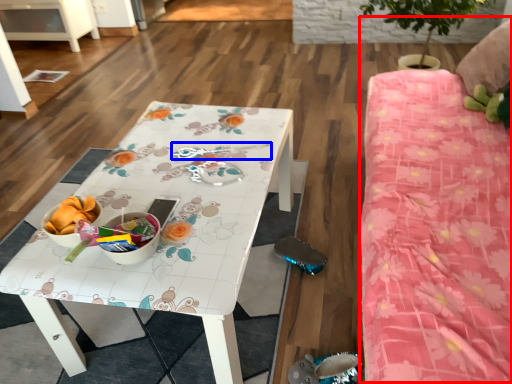
Question: Which of the following is the closest to the observer, bed (highlighted by a red box) or twin (highlighted by a blue box)?

Choices:
 (A) bed
 (B) twin

Answer: (A)